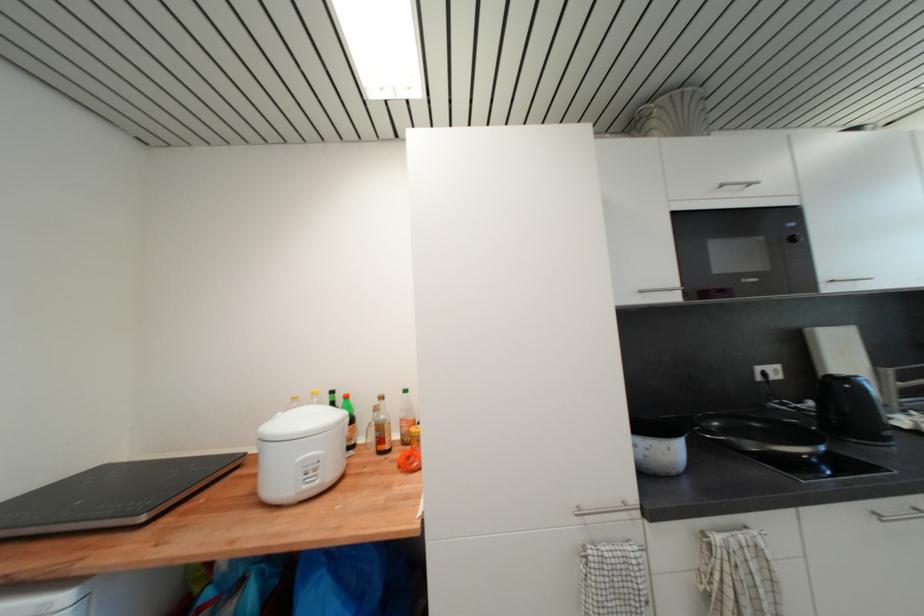
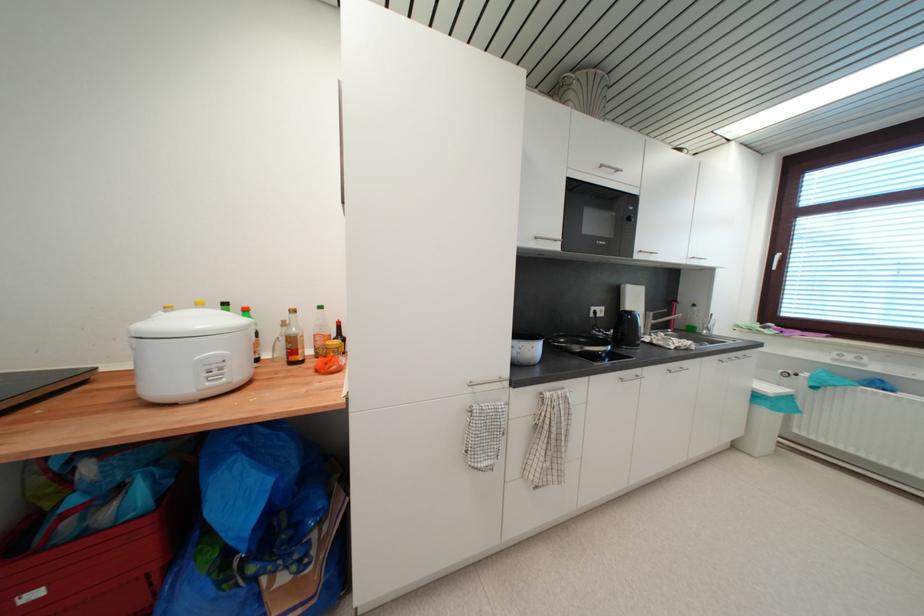
Where in the second image is the point corresponding to the point at 321,472 from the first image?

(225, 371)